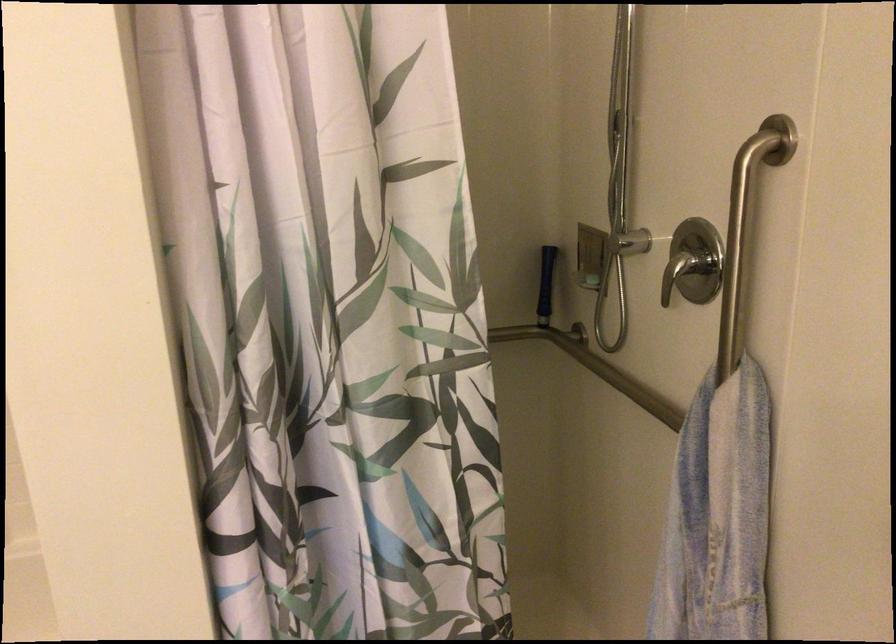
Describe the element at coordinates (693, 263) in the screenshot. I see `a shower diverter knob` at that location.